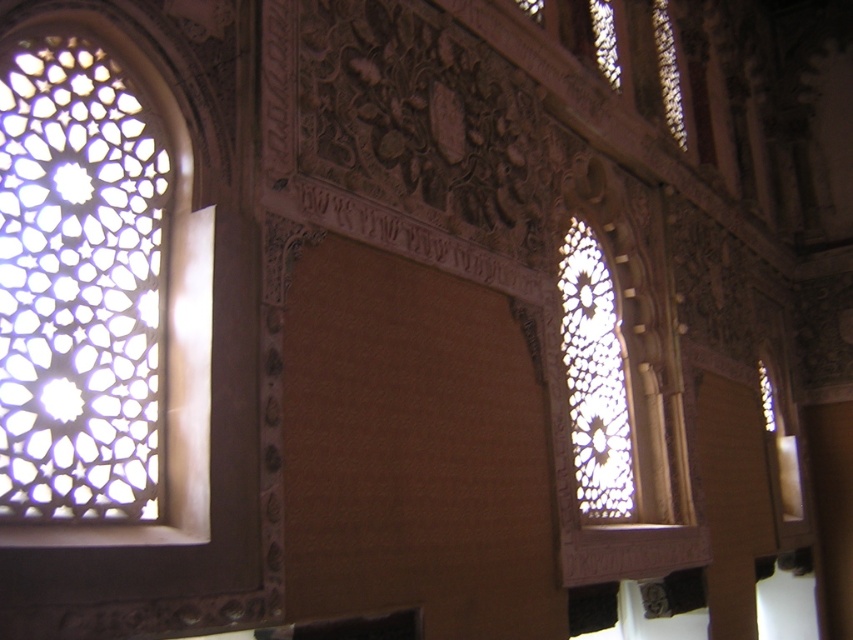
Question: Where is transparent glass window at left located in relation to transparent glass window at right in the image?

Choices:
 (A) left
 (B) right

Answer: (A)

Question: Is transparent glass window at left closer to the viewer compared to transparent glass window at right?

Choices:
 (A) no
 (B) yes

Answer: (B)

Question: Which point is farther to the camera?

Choices:
 (A) transparent glass window at right
 (B) transparent glass window at left

Answer: (A)

Question: Which point is farther to the camera?

Choices:
 (A) (144, 310)
 (B) (572, 410)

Answer: (B)

Question: Does transparent glass window at left lie in front of transparent glass window at right?

Choices:
 (A) yes
 (B) no

Answer: (A)

Question: Among these objects, which one is farthest from the camera?

Choices:
 (A) transparent glass window at right
 (B) transparent glass window at left

Answer: (A)